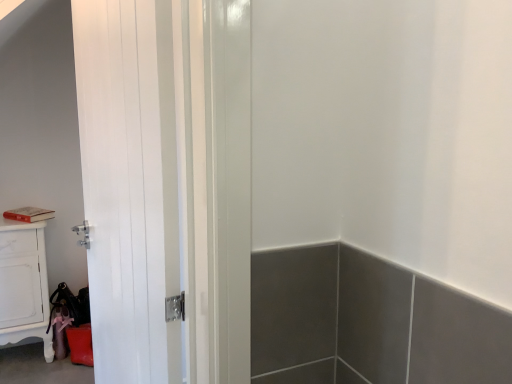
Question: Can you confirm if white glossy cabinet at lower left is positioned to the right of white glossy door at center?

Choices:
 (A) yes
 (B) no

Answer: (B)

Question: From the image's perspective, is white glossy cabinet at lower left over white glossy door at center?

Choices:
 (A) no
 (B) yes

Answer: (A)

Question: Is the depth of white glossy cabinet at lower left greater than that of white glossy door at center?

Choices:
 (A) no
 (B) yes

Answer: (B)

Question: Is white glossy cabinet at lower left smaller than white glossy door at center?

Choices:
 (A) no
 (B) yes

Answer: (B)

Question: Is white glossy cabinet at lower left not close to white glossy door at center?

Choices:
 (A) no
 (B) yes

Answer: (B)

Question: Considering the relative sizes of white glossy cabinet at lower left and white glossy door at center in the image provided, is white glossy cabinet at lower left thinner than white glossy door at center?

Choices:
 (A) no
 (B) yes

Answer: (A)

Question: Are white glossy door at center and white glossy cabinet at lower left beside each other?

Choices:
 (A) yes
 (B) no

Answer: (B)

Question: Does white glossy door at center have a smaller size compared to white glossy cabinet at lower left?

Choices:
 (A) no
 (B) yes

Answer: (A)

Question: Does white glossy door at center contain white glossy cabinet at lower left?

Choices:
 (A) no
 (B) yes

Answer: (A)

Question: Does white glossy door at center have a lesser width compared to white glossy cabinet at lower left?

Choices:
 (A) yes
 (B) no

Answer: (A)

Question: Is white glossy door at center shorter than white glossy cabinet at lower left?

Choices:
 (A) no
 (B) yes

Answer: (A)

Question: From a real-world perspective, is white glossy door at center located beneath white glossy cabinet at lower left?

Choices:
 (A) yes
 (B) no

Answer: (B)

Question: From a real-world perspective, is white glossy cabinet at lower left above or below white glossy door at center?

Choices:
 (A) above
 (B) below

Answer: (B)